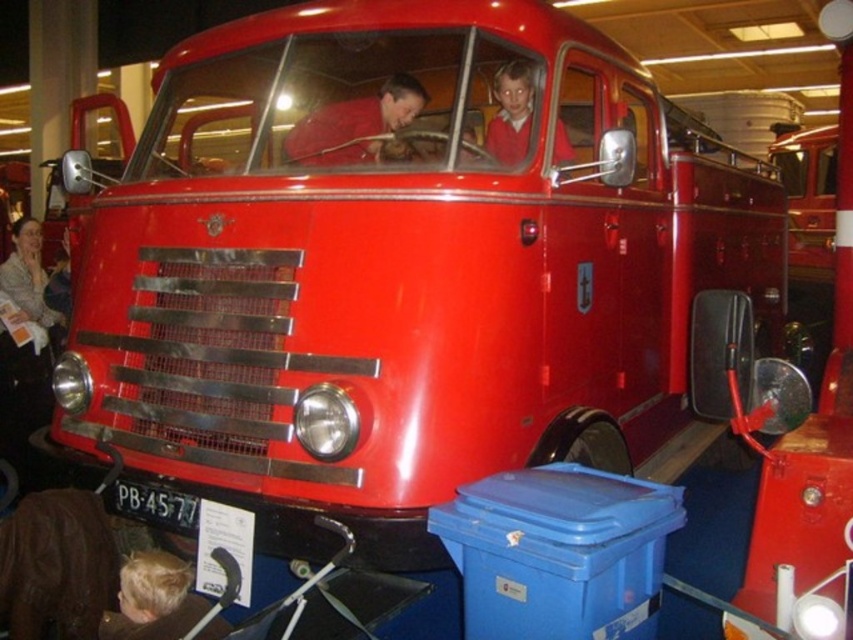
You are a photographer trying to capture the glossy red fire truck at center and the matte red shirt at center in a single frame. Which object should you zoom in on to ensure both are in focus without moving the camera?

You should zoom in on the glossy red fire truck at center because it is thinner than the matte red shirt at center, making it easier to fit both into the frame by focusing on the narrower object.

You are standing in a museum and want to take a photo of the glossy red fire truck at center. The museum has a rule that visitors must stay at least 1 meter away from the fire truck. If the fire truck is positioned at coordinates point 0.692, 0.955, can you stand at point 0.692, 0.955 to take the photo?

The glossy red fire truck at center is positioned at point (814, 442). Standing at that exact point would mean you are right next to the fire truck, violating the museum rule requiring a minimum distance of 1 meter. Therefore, you cannot stand there.